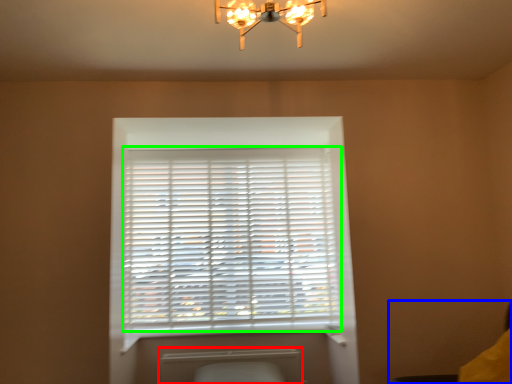
Question: Which object is the farthest from radiator (highlighted by a red box)? Choose among these: swivel chair (highlighted by a blue box) or window blind (highlighted by a green box).

Choices:
 (A) swivel chair
 (B) window blind

Answer: (A)